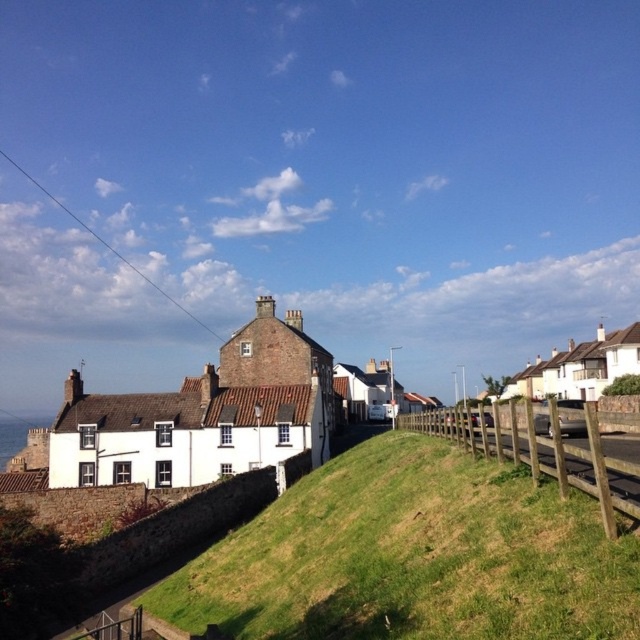
Question: Is green grassy hillside at lower center below wooden fence at lower right?

Choices:
 (A) yes
 (B) no

Answer: (A)

Question: Which object appears closest to the camera in this image?

Choices:
 (A) green grassy hillside at lower center
 (B) wooden fence at lower right

Answer: (A)

Question: Among these objects, which one is farthest from the camera?

Choices:
 (A) green grassy hillside at lower center
 (B) wooden fence at lower right

Answer: (B)

Question: In this image, where is green grassy hillside at lower center located relative to wooden fence at lower right?

Choices:
 (A) below
 (B) above

Answer: (A)

Question: Can you confirm if green grassy hillside at lower center is wider than wooden fence at lower right?

Choices:
 (A) no
 (B) yes

Answer: (A)